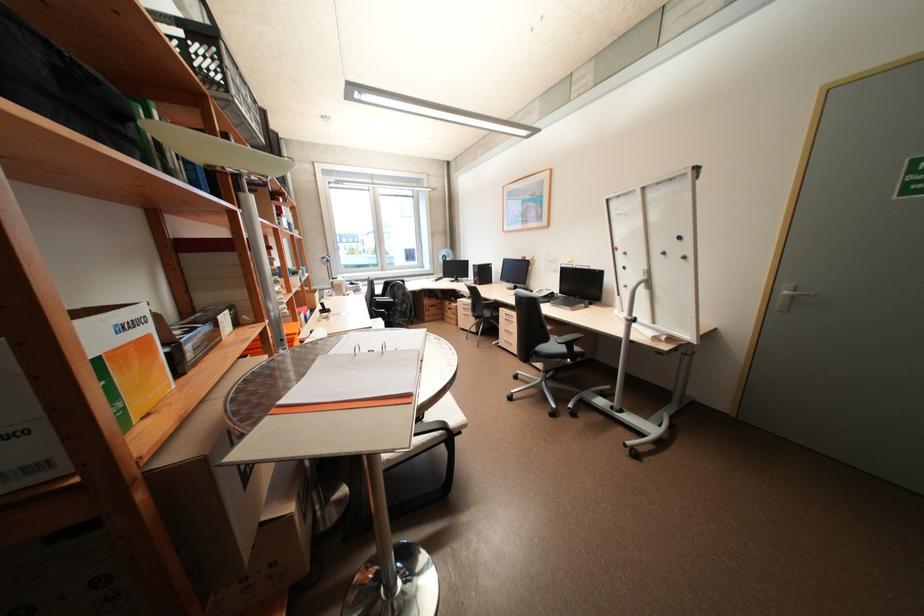
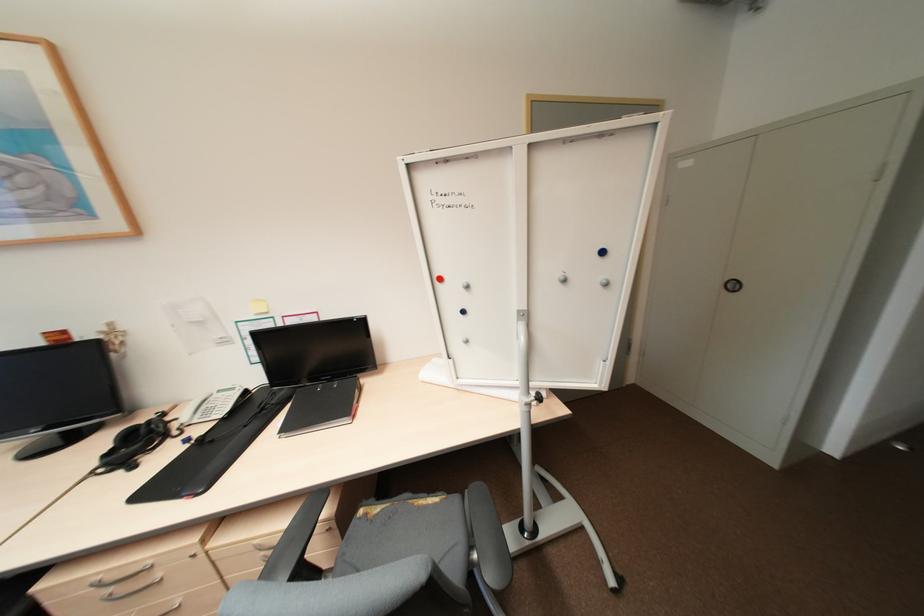
Locate, in the second image, the point that corresponds to pixel 630 286 in the first image.

(472, 341)